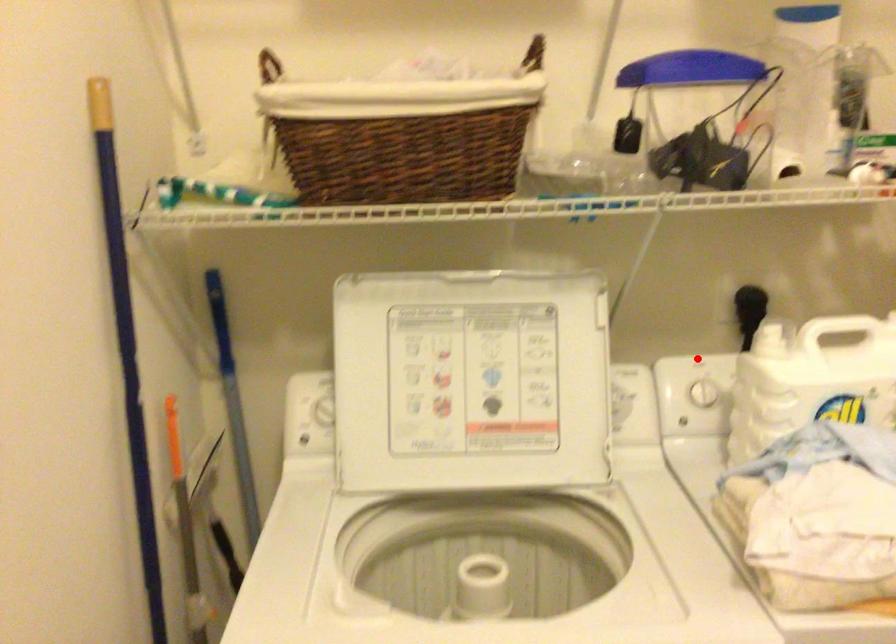
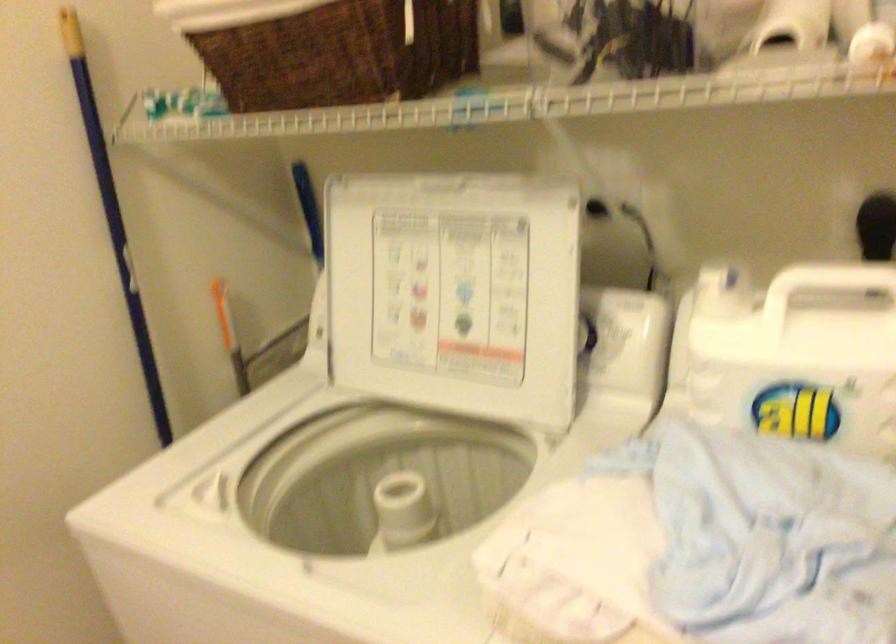
Question: I am providing you with two images of the same scene from different viewpoints. A red point is marked on the first image. Can you still see the location of the red point in image 2?

Choices:
 (A) Yes
 (B) No

Answer: (A)